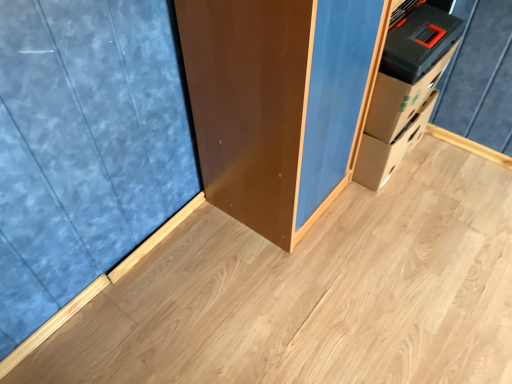
Question: From a real-world perspective, is natural wood plywood at center physically located above or below blue textured curtain at left?

Choices:
 (A) above
 (B) below

Answer: (B)

Question: Is natural wood plywood at center to the left or to the right of blue textured curtain at left in the image?

Choices:
 (A) left
 (B) right

Answer: (B)

Question: Relative to blue textured curtain at left, is natural wood plywood at center in front or behind?

Choices:
 (A) front
 (B) behind

Answer: (B)

Question: Based on their sizes in the image, would you say blue textured curtain at left is bigger or smaller than natural wood plywood at center?

Choices:
 (A) big
 (B) small

Answer: (B)

Question: Is blue textured curtain at left spatially inside natural wood plywood at center, or outside of it?

Choices:
 (A) inside
 (B) outside

Answer: (B)

Question: Relative to natural wood plywood at center, is blue textured curtain at left in front or behind?

Choices:
 (A) front
 (B) behind

Answer: (A)

Question: From a real-world perspective, relative to natural wood plywood at center, is blue textured curtain at left vertically above or below?

Choices:
 (A) above
 (B) below

Answer: (A)